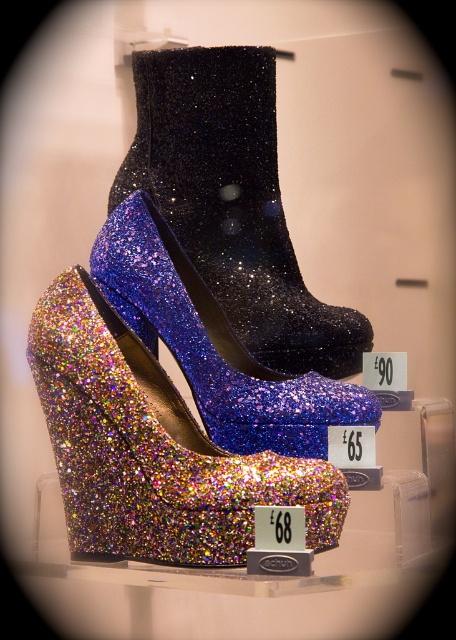
You are a customer trying to choose between the glittery black boot at center and the glittery blue platform shoe at center. Based on their widths, which one is narrower?

The glittery black boot at center is narrower than the glittery blue platform shoe at center.

You are a customer in a shoe store looking at the glittery multicolor platform shoe at center and the glittery blue platform shoe at center. Which shoe is located to the left?

The glittery multicolor platform shoe at center is positioned on the left side of the glittery blue platform shoe at center, so it is the one located to the left.